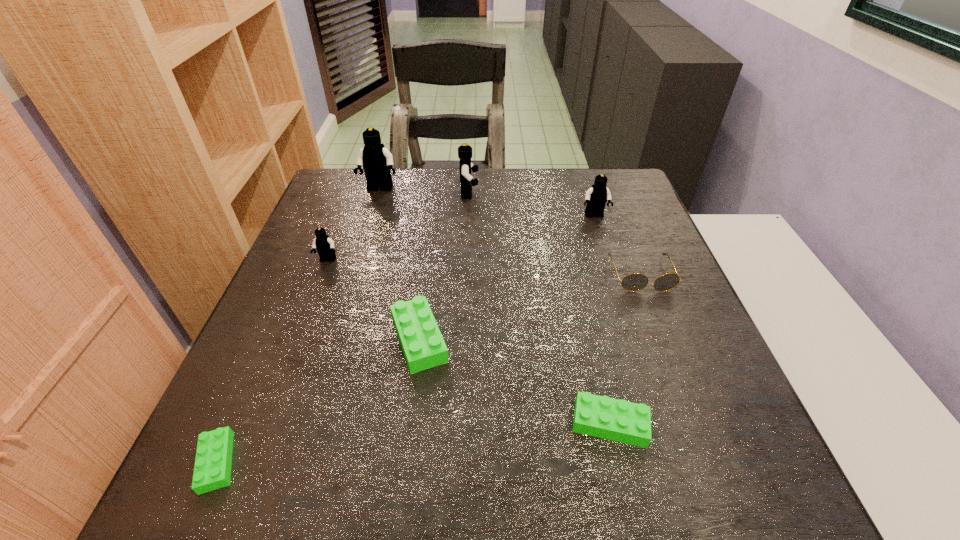
Locate an element on the screen. This screenshot has width=960, height=540. vacant area that lies between the third nearest Lego and the tallest object is located at coordinates (399, 265).

I want to click on vacant space that is in between the fifth nearest Lego and the smallest black Lego, so pos(461,238).

Image resolution: width=960 pixels, height=540 pixels. What are the coordinates of `blank region between the rightmost green Lego and the second green Lego from right to left` in the screenshot? It's located at (515, 382).

You are a GUI agent. You are given a task and a screenshot of the screen. Output one action in this format:
    pyautogui.click(x=<x>, y=<y>)
    Task: Click on the free space between the tallest Lego and the gray sunglasses
    
    Given the screenshot: What is the action you would take?
    tap(511, 232)

The image size is (960, 540). In order to click on vacant space in between the sixth tallest Lego and the fourth nearest Lego in this screenshot , I will do `click(468, 342)`.

Locate which object is the fourth closest to the sixth shortest object. Please provide its 2D coordinates. Your answer should be formatted as a tuple, i.e. [(x, y)], where the tuple contains the x and y coordinates of a point satisfying the conditions above.

[(377, 161)]

Where is `the fifth closest object to the seventh shortest object`? the fifth closest object to the seventh shortest object is located at coordinates (423, 346).

The image size is (960, 540). I want to click on the second closest Lego to the nearest black Lego, so click(377, 161).

I want to click on Lego that is the closest to the rightmost green Lego, so click(x=423, y=346).

The height and width of the screenshot is (540, 960). Find the location of `the second closest black Lego to the fifth shortest Lego`. the second closest black Lego to the fifth shortest Lego is located at coordinates (377, 161).